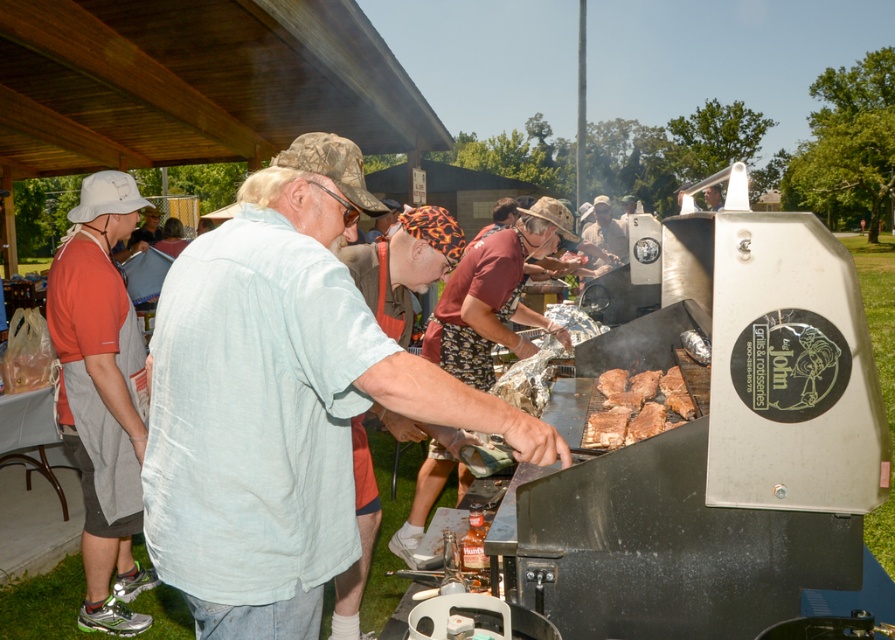
Question: Can you confirm if light blue cotton shirt at center is positioned to the left of orange t-shirt at left?

Choices:
 (A) yes
 (B) no

Answer: (B)

Question: Which object is farther from the camera taking this photo?

Choices:
 (A) light blue cotton shirt at center
 (B) brown matte ribs at center
 (C) orange t-shirt at left

Answer: (C)

Question: Does light blue cotton shirt at center have a larger size compared to orange t-shirt at left?

Choices:
 (A) yes
 (B) no

Answer: (B)

Question: Among these points, which one is farthest from the camera?

Choices:
 (A) (270, 632)
 (B) (58, 291)

Answer: (B)

Question: Which point is closer to the camera?

Choices:
 (A) (631, 387)
 (B) (124, 211)
 (C) (245, 492)
 (D) (595, 202)

Answer: (C)

Question: Can you confirm if brown matte ribs at center is positioned below matte khaki shirt at center?

Choices:
 (A) yes
 (B) no

Answer: (A)